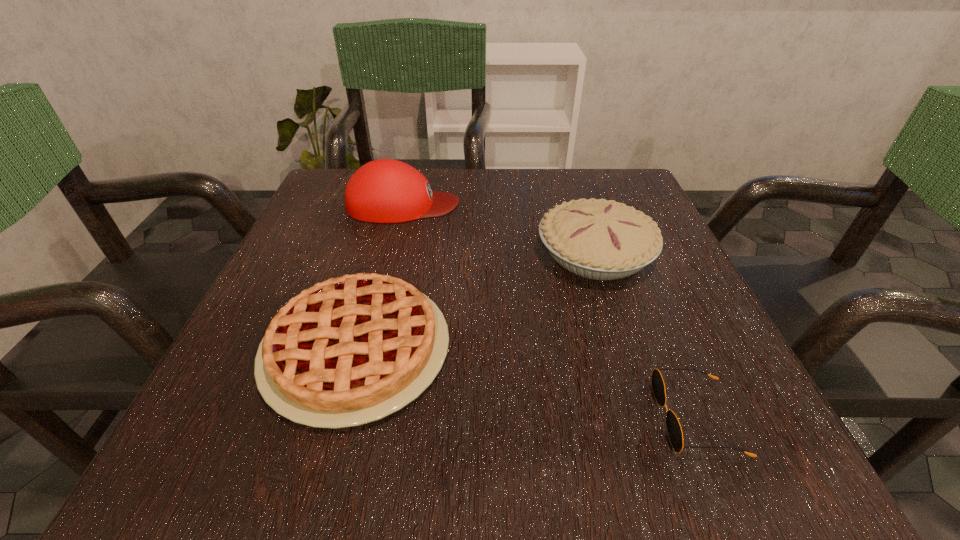
This screenshot has height=540, width=960. What are the coordinates of `baseball cap` in the screenshot? It's located at (385, 190).

Locate an element on the screen. This screenshot has height=540, width=960. the third shortest object is located at coordinates [598, 239].

Where is `the taller pie`? Image resolution: width=960 pixels, height=540 pixels. the taller pie is located at coordinates (598, 239).

At what (x,y) coordinates should I click in order to perform the action: click on the third tallest object. Please return your answer as a coordinate pair (x, y). This screenshot has height=540, width=960. Looking at the image, I should click on (x=351, y=350).

Locate an element on the screen. The image size is (960, 540). the left pie is located at coordinates (351, 350).

Where is `the shortest object`? This screenshot has width=960, height=540. the shortest object is located at coordinates (674, 429).

The height and width of the screenshot is (540, 960). Identify the location of free region located on the front-facing side of the tallest object. (527, 205).

You are a GUI agent. You are given a task and a screenshot of the screen. Output one action in this format:
    pyautogui.click(x=<x>, y=<y>)
    Task: Click on the vacant space located 0.120m on the left of the second tallest object
    The height and width of the screenshot is (540, 960).
    Given the screenshot: What is the action you would take?
    pyautogui.click(x=474, y=253)

Image resolution: width=960 pixels, height=540 pixels. What are the coordinates of `vacant space located 0.340m on the right of the second shortest object` in the screenshot? It's located at (674, 349).

The width and height of the screenshot is (960, 540). I want to click on vacant space located on the front-facing side of the sunglasses, so click(x=416, y=417).